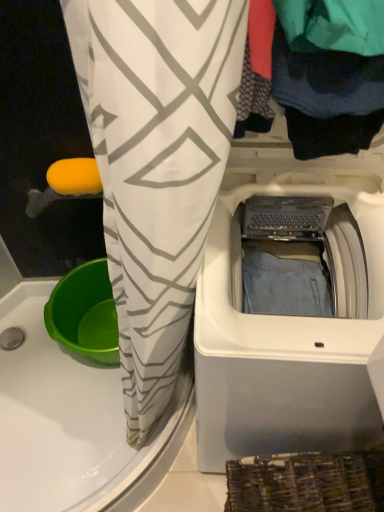
Question: From a real-world perspective, does dark blue fabric at upper right sit lower than white plastic washing machine at upper right?

Choices:
 (A) no
 (B) yes

Answer: (A)

Question: Can you confirm if dark blue fabric at upper right is bigger than white plastic washing machine at upper right?

Choices:
 (A) no
 (B) yes

Answer: (A)

Question: Can you confirm if dark blue fabric at upper right is positioned to the left of white plastic washing machine at upper right?

Choices:
 (A) yes
 (B) no

Answer: (B)

Question: Does dark blue fabric at upper right lie behind white plastic washing machine at upper right?

Choices:
 (A) no
 (B) yes

Answer: (A)

Question: Considering the relative sizes of dark blue fabric at upper right and white plastic washing machine at upper right in the image provided, is dark blue fabric at upper right wider than white plastic washing machine at upper right?

Choices:
 (A) no
 (B) yes

Answer: (A)

Question: Is dark blue fabric at upper right directly adjacent to white plastic washing machine at upper right?

Choices:
 (A) no
 (B) yes

Answer: (A)

Question: From a real-world perspective, is white plastic washing machine at upper right physically above dark blue fabric at upper right?

Choices:
 (A) yes
 (B) no

Answer: (B)

Question: Is white plastic washing machine at upper right far away from dark blue fabric at upper right?

Choices:
 (A) yes
 (B) no

Answer: (B)

Question: Considering the relative sizes of white plastic washing machine at upper right and dark blue fabric at upper right in the image provided, is white plastic washing machine at upper right wider than dark blue fabric at upper right?

Choices:
 (A) no
 (B) yes

Answer: (B)

Question: From the image's perspective, is white plastic washing machine at upper right located beneath dark blue fabric at upper right?

Choices:
 (A) yes
 (B) no

Answer: (A)

Question: From a real-world perspective, is white plastic washing machine at upper right positioned under dark blue fabric at upper right based on gravity?

Choices:
 (A) no
 (B) yes

Answer: (B)

Question: Can you confirm if white plastic washing machine at upper right is taller than dark blue fabric at upper right?

Choices:
 (A) yes
 (B) no

Answer: (A)

Question: Looking at their shapes, would you say white plastic washing machine at upper right is wider or thinner than dark blue fabric at upper right?

Choices:
 (A) wide
 (B) thin

Answer: (A)